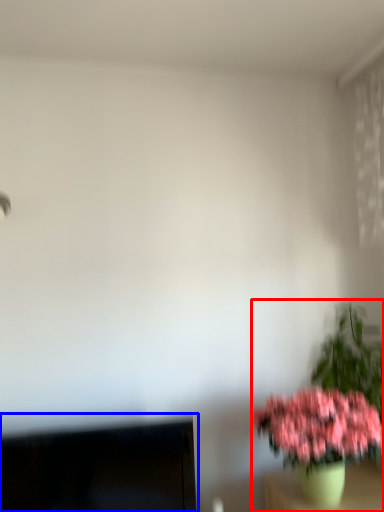
Question: Which object is further to the camera taking this photo, houseplant (highlighted by a red box) or computer monitor (highlighted by a blue box)?

Choices:
 (A) houseplant
 (B) computer monitor

Answer: (B)